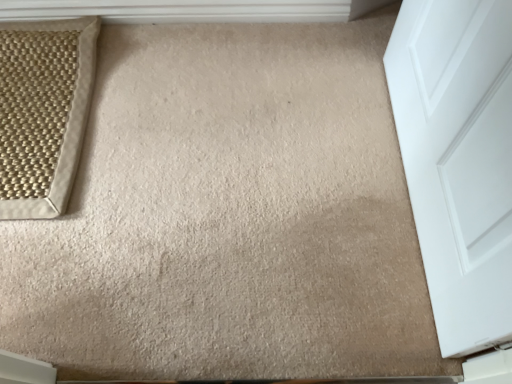
What do you see at coordinates (42, 112) in the screenshot? I see `beige woven rug at upper left` at bounding box center [42, 112].

This screenshot has width=512, height=384. In order to click on beige woven rug at upper left in this screenshot , I will do `click(42, 112)`.

Identify the location of beige woven rug at upper left. (42, 112).